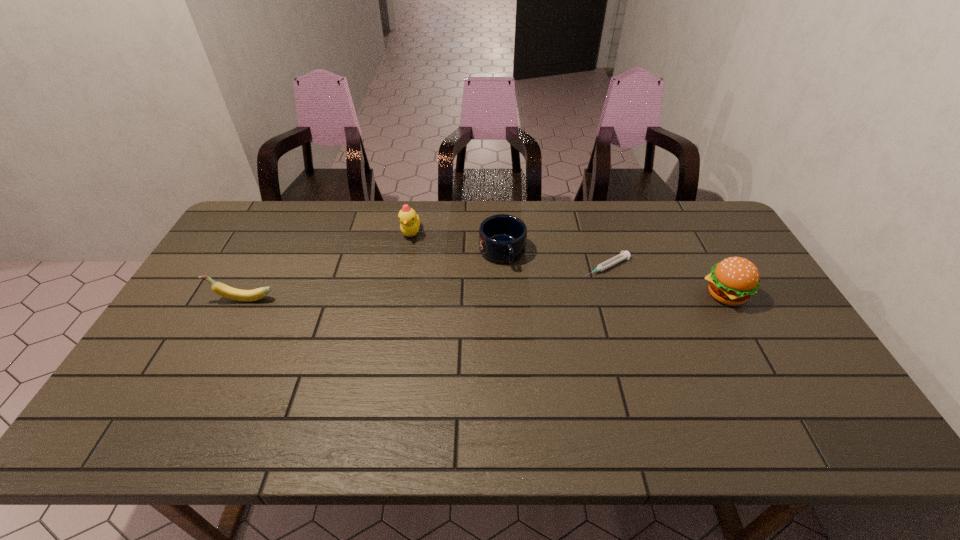
Find the location of a particular element. object that is at the right edge is located at coordinates (732, 281).

In the image, there is a desktop. Where is `vacant space at the far edge`? vacant space at the far edge is located at coordinates (471, 243).

Where is `free space at the near edge of the desktop`? The width and height of the screenshot is (960, 540). free space at the near edge of the desktop is located at coordinates (556, 373).

Image resolution: width=960 pixels, height=540 pixels. I want to click on free space at the left edge of the desktop, so click(155, 359).

Where is `vacant area at the near right corner`? The image size is (960, 540). vacant area at the near right corner is located at coordinates (838, 397).

Locate an element on the screen. The image size is (960, 540). vacant area between the hamburger and the banana is located at coordinates (485, 297).

Where is `empty space that is in between the banana and the shortest object`? empty space that is in between the banana and the shortest object is located at coordinates (425, 283).

Where is `vacant point located between the duckling and the third object from left to right`? This screenshot has height=540, width=960. vacant point located between the duckling and the third object from left to right is located at coordinates (457, 242).

I want to click on free point between the rightmost object and the shortest object, so click(x=666, y=281).

Where is `vacant space that is in between the mug and the second object from right to left`? vacant space that is in between the mug and the second object from right to left is located at coordinates (555, 260).